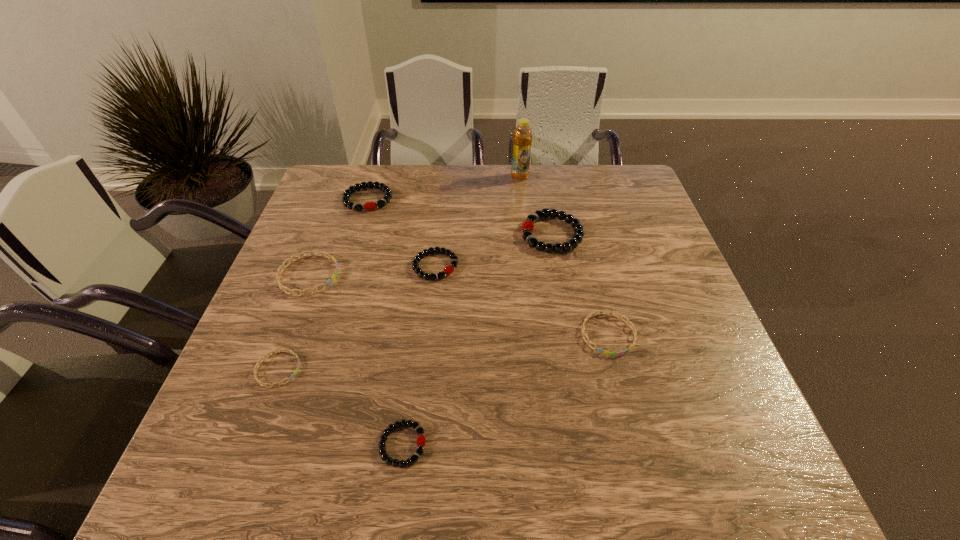
I want to click on vacant position located 0.060m on the surface of the shortest object showing star-shaped elements, so click(328, 369).

Where is `bottle located in the far edge section of the desktop`? The image size is (960, 540). bottle located in the far edge section of the desktop is located at coordinates (522, 136).

Identify the location of bracelet located in the far edge section of the desktop. The height and width of the screenshot is (540, 960). (348, 192).

At what (x,y) coordinates should I click in order to perform the action: click on object positioned at the near edge. Please return your answer as a coordinate pair (x, y). The image size is (960, 540). Looking at the image, I should click on [421, 441].

This screenshot has width=960, height=540. Identify the location of object that is positioned at the right edge. (584, 334).

Identify the location of object that is at the far left corner. (348, 192).

Find the location of `vacant space at the far edge of the desktop`. vacant space at the far edge of the desktop is located at coordinates (415, 206).

Where is `vacant point at the near edge`? This screenshot has width=960, height=540. vacant point at the near edge is located at coordinates tap(453, 490).

At what (x,y) coordinates should I click in order to perform the action: click on free spot at the left edge of the desktop. Please return your answer as a coordinate pair (x, y). This screenshot has height=540, width=960. Looking at the image, I should click on (290, 359).

Where is `free space at the right edge`? This screenshot has height=540, width=960. free space at the right edge is located at coordinates (671, 328).